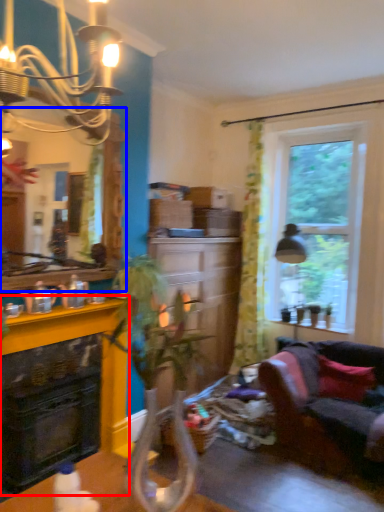
Question: Which object appears farthest to the camera in this image, fireplace (highlighted by a red box) or mirror (highlighted by a blue box)?

Choices:
 (A) fireplace
 (B) mirror

Answer: (A)